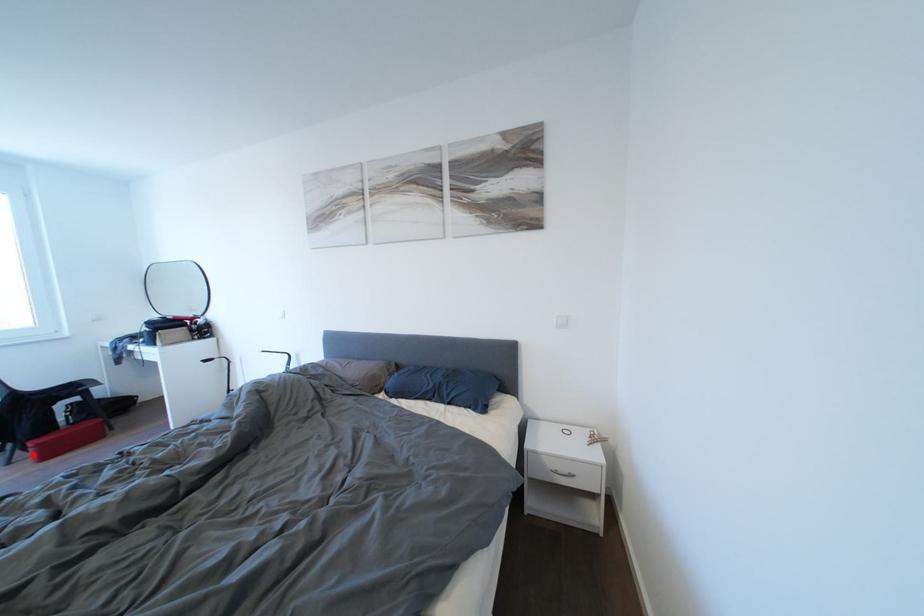
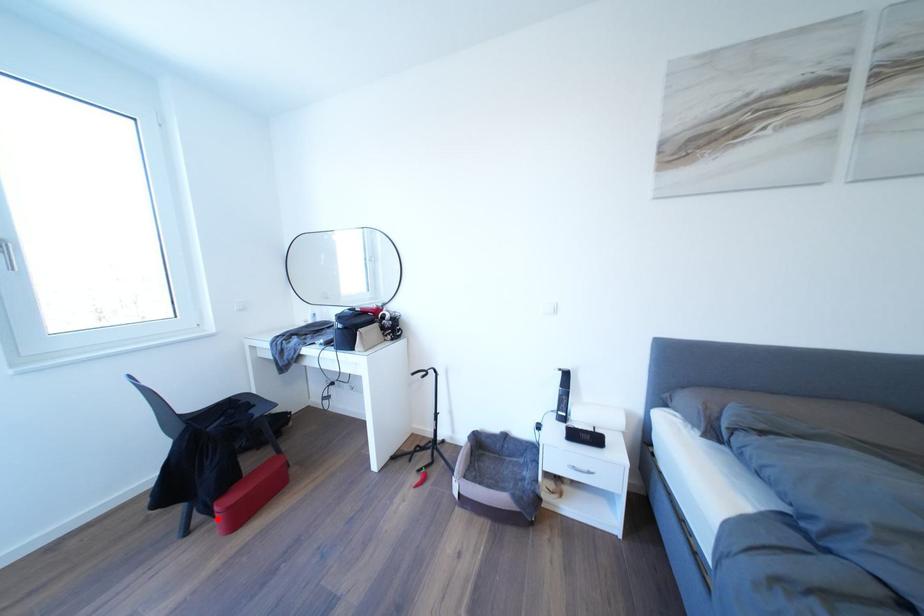
I am providing you with two images of the same scene from different viewpoints. A red point is marked on the first image and another point is marked on the second image. Are the points marked in image1 and image2 representing the same 3D position?

Yes